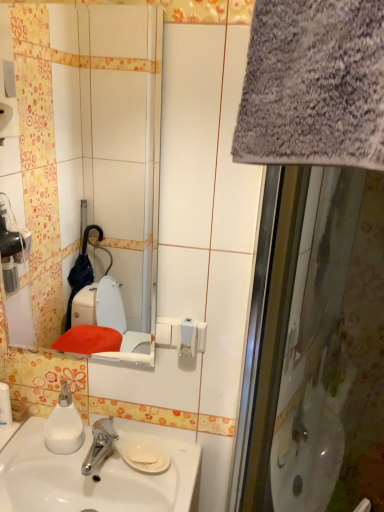
The width and height of the screenshot is (384, 512). I want to click on vacant area that is situated to the right of white glossy soap dispenser at lower left, so click(x=59, y=444).